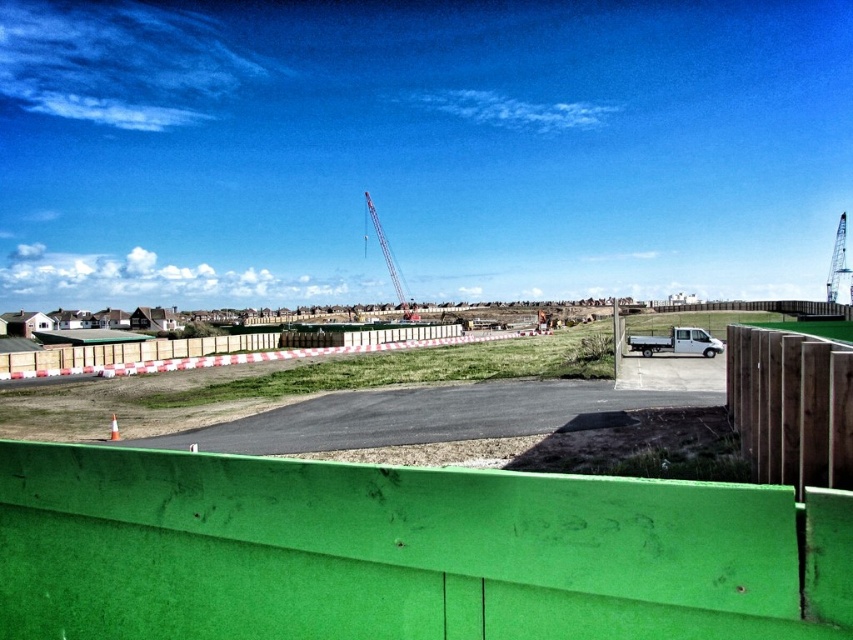
Can you confirm if green painted wood at lower center is positioned to the right of wooden fence at center?

Indeed, green painted wood at lower center is positioned on the right side of wooden fence at center.

The image size is (853, 640). What do you see at coordinates (403, 552) in the screenshot?
I see `green painted wood at lower center` at bounding box center [403, 552].

Between point (422, 616) and point (360, 348), which one is positioned in front?

Point (422, 616)

This screenshot has width=853, height=640. In order to click on green painted wood at lower center in this screenshot , I will do `click(403, 552)`.

Can you confirm if brown dirt track at center is wider than metallic silver crane at center?

Yes.

This screenshot has height=640, width=853. What do you see at coordinates (589, 448) in the screenshot?
I see `brown dirt track at center` at bounding box center [589, 448].

Where is `brown dirt track at center`? This screenshot has width=853, height=640. brown dirt track at center is located at coordinates (589, 448).

Who is shorter, green painted wood at lower center or brown dirt track at center?

Standing shorter between the two is green painted wood at lower center.

Between green painted wood at lower center and brown dirt track at center, which one appears on the right side from the viewer's perspective?

brown dirt track at center is more to the right.

Which is in front, point (659, 564) or point (662, 472)?

Point (659, 564) is in front.

Locate an element on the screen. The height and width of the screenshot is (640, 853). green painted wood at lower center is located at coordinates (403, 552).